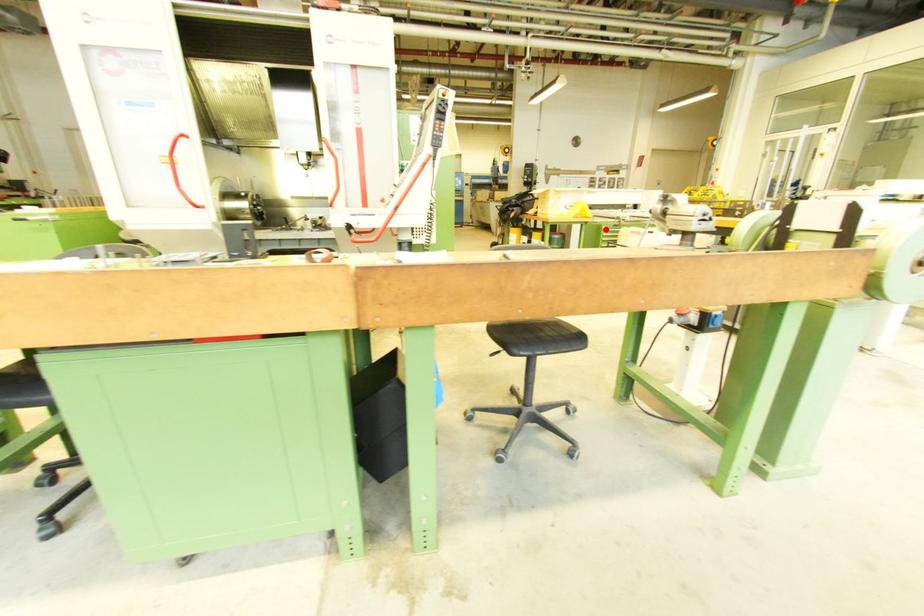
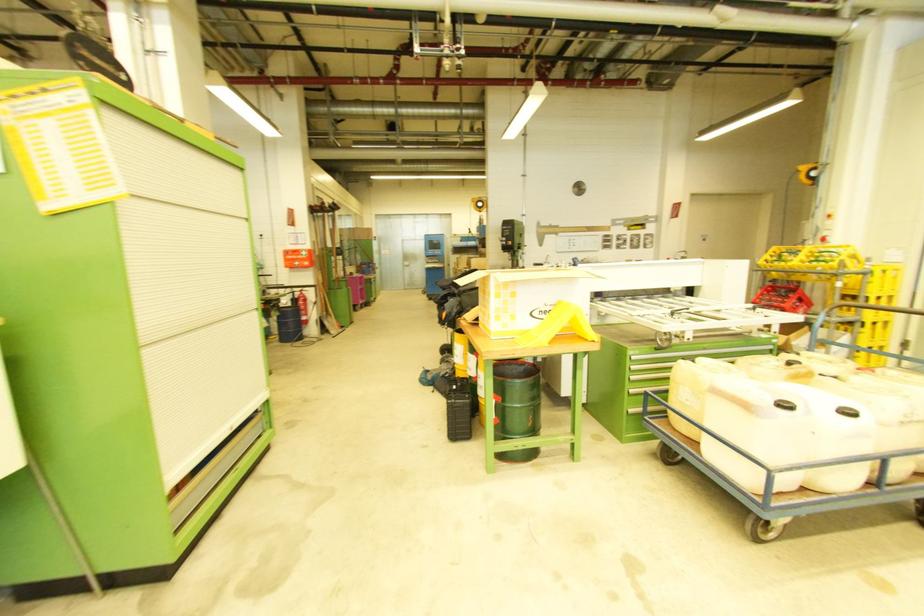
Find the pixel in the second image that matches the highlighted location in the first image.

(631, 355)